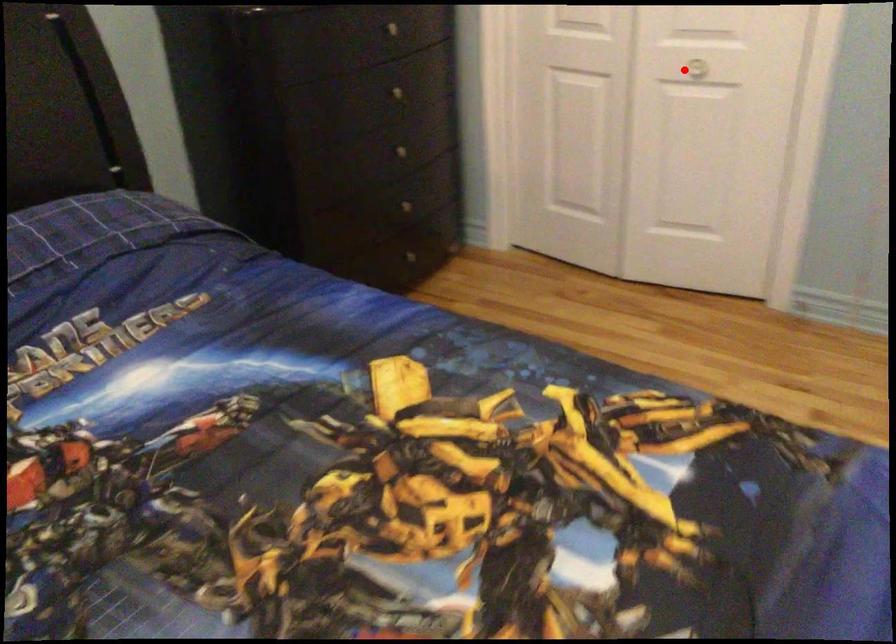
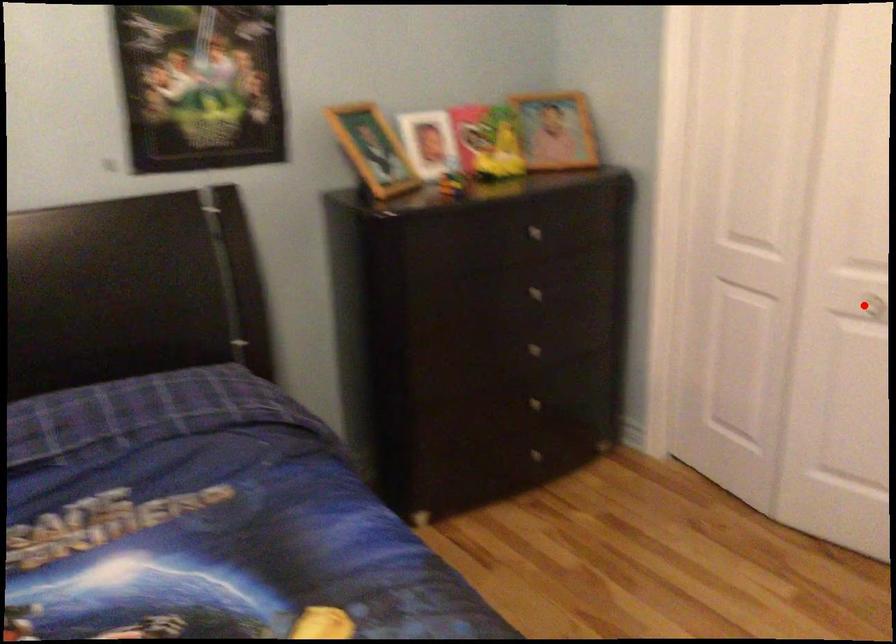
I am providing you with two images of the same scene from different viewpoints. A red point is marked on the first image and another point is marked on the second image. Is the marked point in image1 the same physical position as the marked point in image2?

Yes